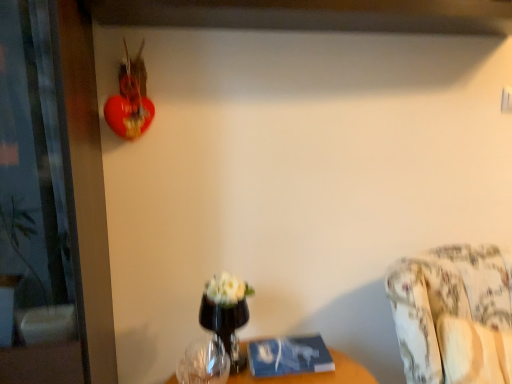
Question: From the image's perspective, would you say transparent glass vase at center is positioned over transparent glass screen door at left?

Choices:
 (A) no
 (B) yes

Answer: (A)

Question: From a real-world perspective, is transparent glass vase at center physically below transparent glass screen door at left?

Choices:
 (A) yes
 (B) no

Answer: (A)

Question: Can you confirm if transparent glass vase at center is smaller than transparent glass screen door at left?

Choices:
 (A) no
 (B) yes

Answer: (B)

Question: Is transparent glass vase at center wider than transparent glass screen door at left?

Choices:
 (A) no
 (B) yes

Answer: (A)

Question: Is transparent glass vase at center positioned with its back to transparent glass screen door at left?

Choices:
 (A) no
 (B) yes

Answer: (A)

Question: Are transparent glass vase at center and transparent glass screen door at left beside each other?

Choices:
 (A) yes
 (B) no

Answer: (B)

Question: Is transparent glass vase at lower center behind transparent glass screen door at left?

Choices:
 (A) no
 (B) yes

Answer: (B)

Question: Is transparent glass vase at lower center facing away from transparent glass screen door at left?

Choices:
 (A) yes
 (B) no

Answer: (B)

Question: Can you confirm if transparent glass vase at lower center is smaller than transparent glass screen door at left?

Choices:
 (A) no
 (B) yes

Answer: (B)

Question: Does transparent glass vase at lower center have a lesser height compared to transparent glass screen door at left?

Choices:
 (A) yes
 (B) no

Answer: (A)

Question: Is transparent glass vase at lower center positioned in front of transparent glass screen door at left?

Choices:
 (A) no
 (B) yes

Answer: (A)

Question: From a real-world perspective, is transparent glass vase at lower center over transparent glass screen door at left?

Choices:
 (A) no
 (B) yes

Answer: (A)

Question: From a real-world perspective, is transparent glass vase at lower center over transparent glass vase at center?

Choices:
 (A) no
 (B) yes

Answer: (A)